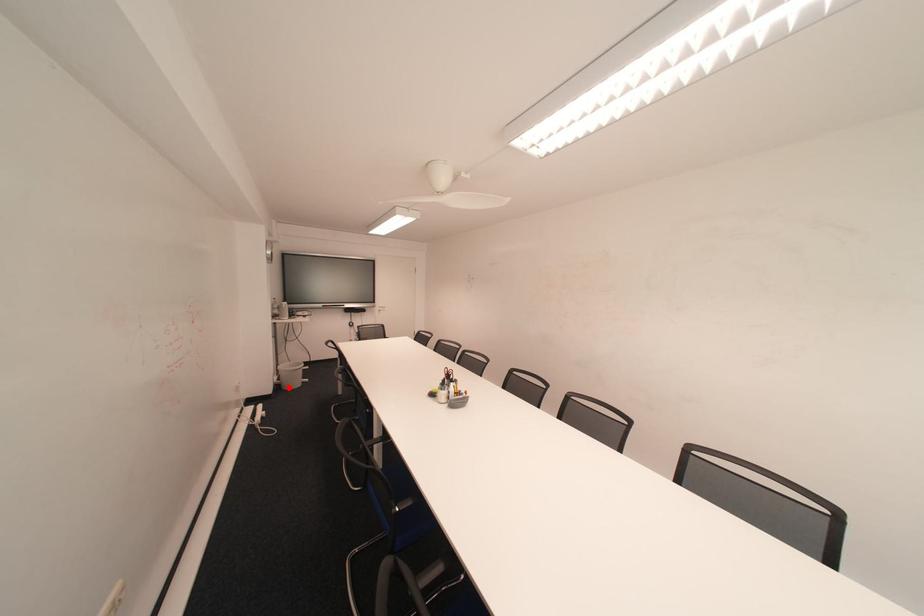
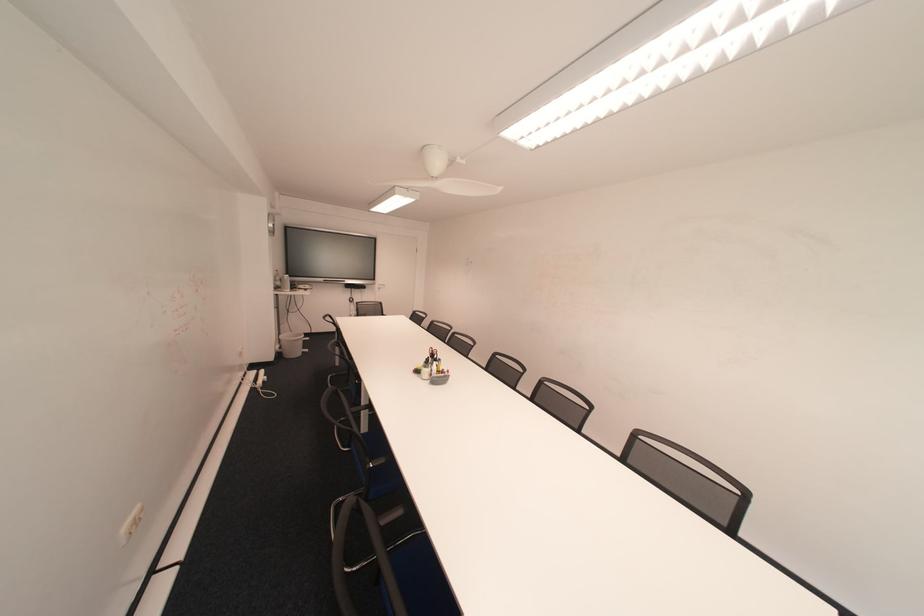
Question: I am providing you with two images of the same scene from different viewpoints. Given a red point in image1, look at the same physical point in image2. Is it:

Choices:
 (A) Closer to the viewpoint
 (B) Farther from the viewpoint

Answer: (B)